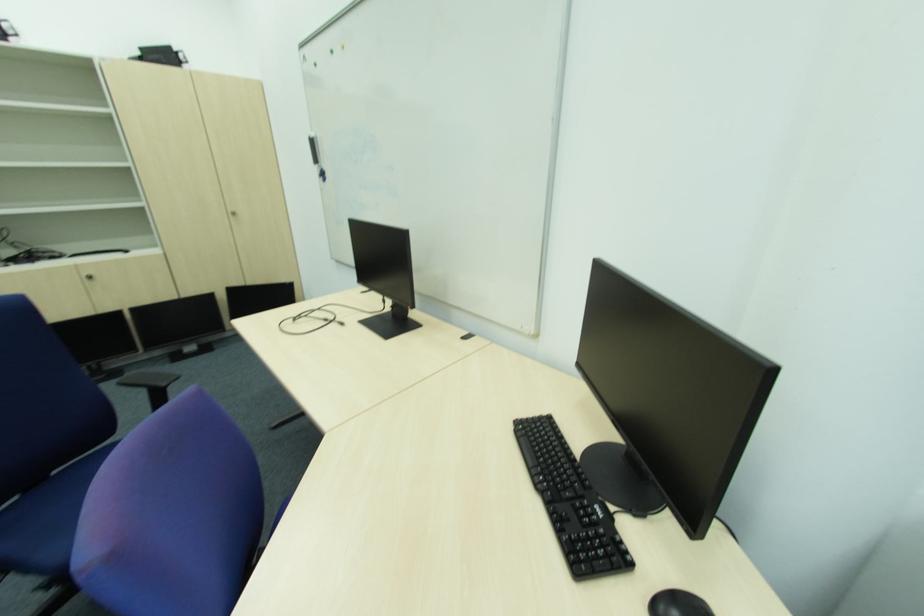
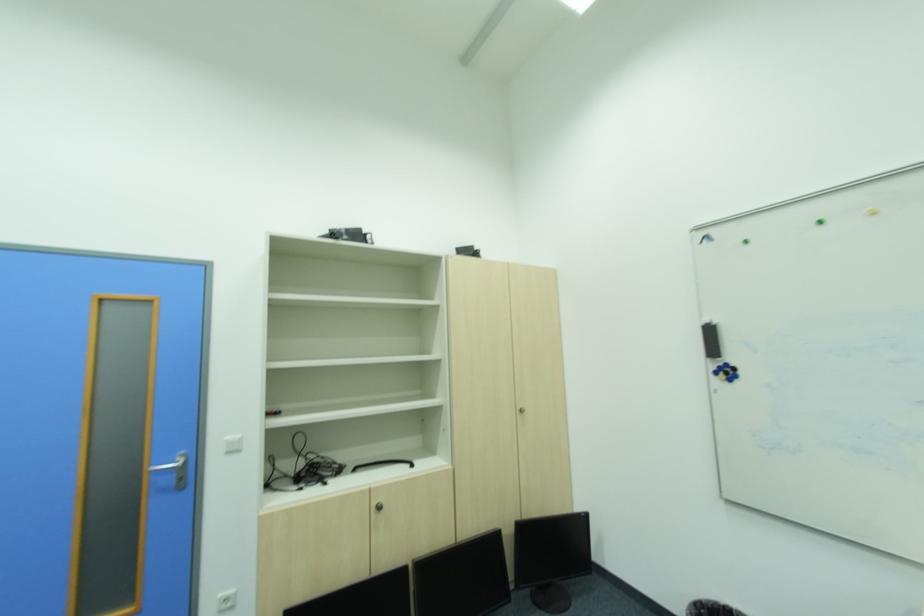
In the second image, find the point that corresponds to (238,291) in the first image.

(531, 531)